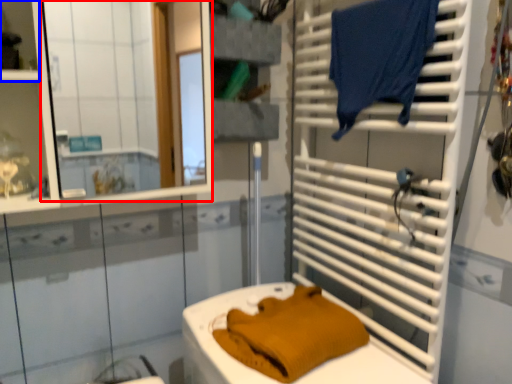
Question: Which point is closer to the camera, mirror (highlighted by a red box) or shelf (highlighted by a blue box)?

Choices:
 (A) mirror
 (B) shelf

Answer: (A)